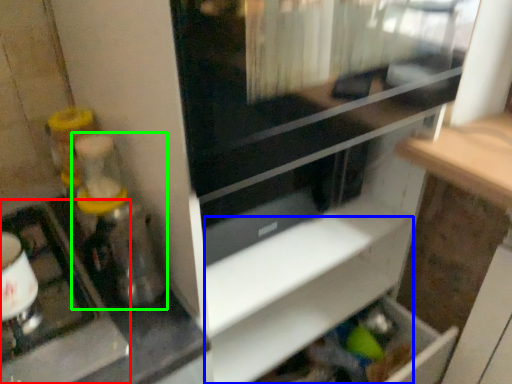
Question: Considering the real-world distances, which object is closest to appliance (highlighted by a red box)? shelf (highlighted by a blue box) or blender (highlighted by a green box).

Choices:
 (A) shelf
 (B) blender

Answer: (B)